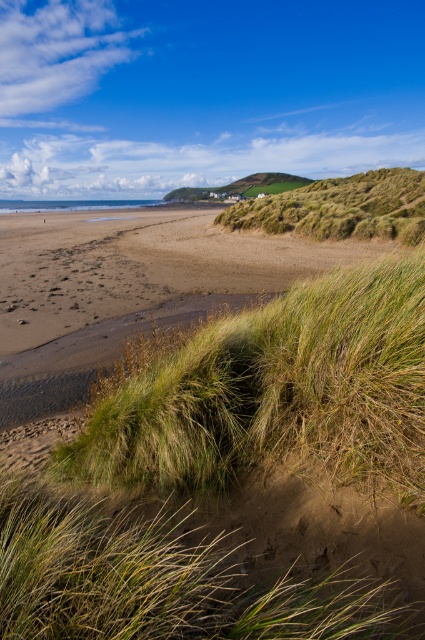
In the scene shown: You are standing on the beach and want to walk towards the green grassy at lower left and the green grassy hill at upper right. Which one will you reach first?

You will reach the green grassy at lower left first because it is closer to you than the green grassy hill at upper right.

You are standing on the sandy beach and want to walk towards the green grassy hill at upper right. Which direction should you head to avoid the green grassy at lower left?

To reach the green grassy hill at upper right while avoiding the green grassy at lower left, you should head to the right side, as the green grassy at lower left is located to the left of the green grassy hill at upper right.